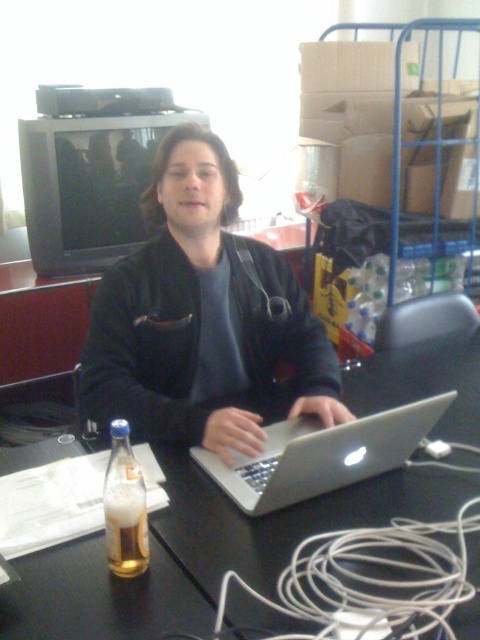
Question: Which of these objects is positioned farthest from the translucent glass beer at lower left?

Choices:
 (A) black matte jacket at center
 (B) silver metallic laptop at center
 (C) black plastic laptop at center

Answer: (A)

Question: Is silver metallic laptop at center to the left of translucent glass bottle at lower left from the viewer's perspective?

Choices:
 (A) no
 (B) yes

Answer: (A)

Question: Which point is farther from the camera taking this photo?

Choices:
 (A) (133, 508)
 (B) (123, 572)
 (C) (172, 550)

Answer: (C)

Question: Can you confirm if black matte jacket at center is bigger than translucent glass bottle at lower left?

Choices:
 (A) yes
 (B) no

Answer: (A)

Question: Which point is closer to the camera?

Choices:
 (A) black matte jacket at center
 (B) translucent glass bottle at lower left
 (C) translucent glass beer at lower left
 (D) black plastic laptop at center

Answer: (D)

Question: Does silver metallic laptop at center appear under translucent glass beer at lower left?

Choices:
 (A) yes
 (B) no

Answer: (B)